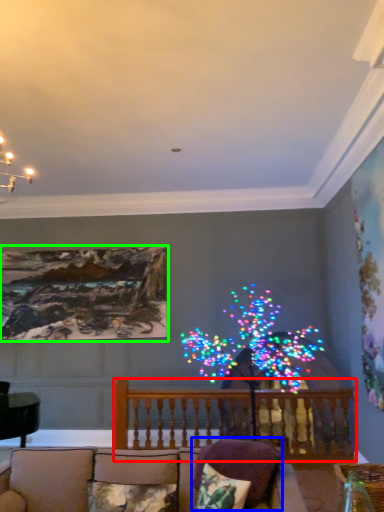
Question: Estimate the real-world distances between objects in this image. Which object is farther from balcony (highlighted by a red box), pillow (highlighted by a blue box) or picture frame (highlighted by a green box)?

Choices:
 (A) pillow
 (B) picture frame

Answer: (B)